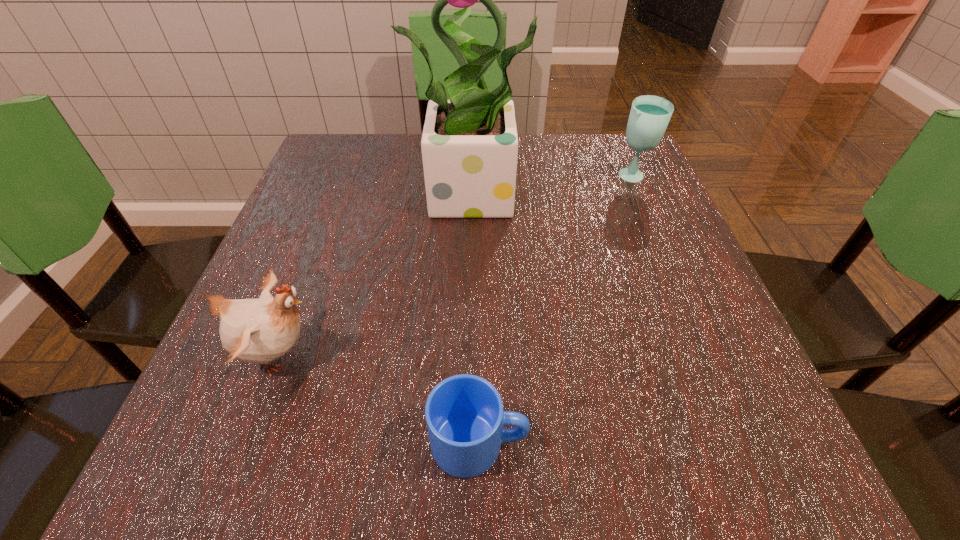
Image resolution: width=960 pixels, height=540 pixels. I want to click on flower arrangement, so click(x=469, y=144).

Find the location of `glass`. glass is located at coordinates click(x=649, y=116).

Where is `bird`? This screenshot has height=540, width=960. bird is located at coordinates (258, 331).

This screenshot has width=960, height=540. I want to click on the shortest object, so click(x=464, y=414).

Where is `vacant space situated on the front-facing side of the flower arrangement`? The width and height of the screenshot is (960, 540). vacant space situated on the front-facing side of the flower arrangement is located at coordinates (481, 403).

I want to click on free space located 0.370m on the front of the rightmost object, so click(x=695, y=324).

Where is `blank space located 0.260m at the beak of the bird`? blank space located 0.260m at the beak of the bird is located at coordinates (499, 355).

This screenshot has height=540, width=960. Find the location of `free space located on the side of the mug with the handle`. free space located on the side of the mug with the handle is located at coordinates (582, 443).

Where is `flower arrangement that is at the far edge`? flower arrangement that is at the far edge is located at coordinates (469, 144).

Where is `glass present at the far edge`? The image size is (960, 540). glass present at the far edge is located at coordinates (649, 116).